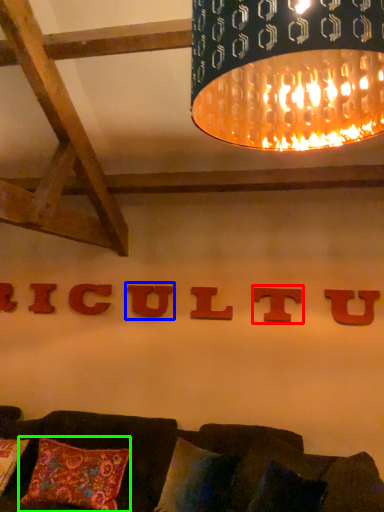
Question: Estimate the real-world distances between objects in this image. Which object is closer to alphabet (highlighted by a red box), alphabet (highlighted by a blue box) or pillow (highlighted by a green box)?

Choices:
 (A) alphabet
 (B) pillow

Answer: (A)